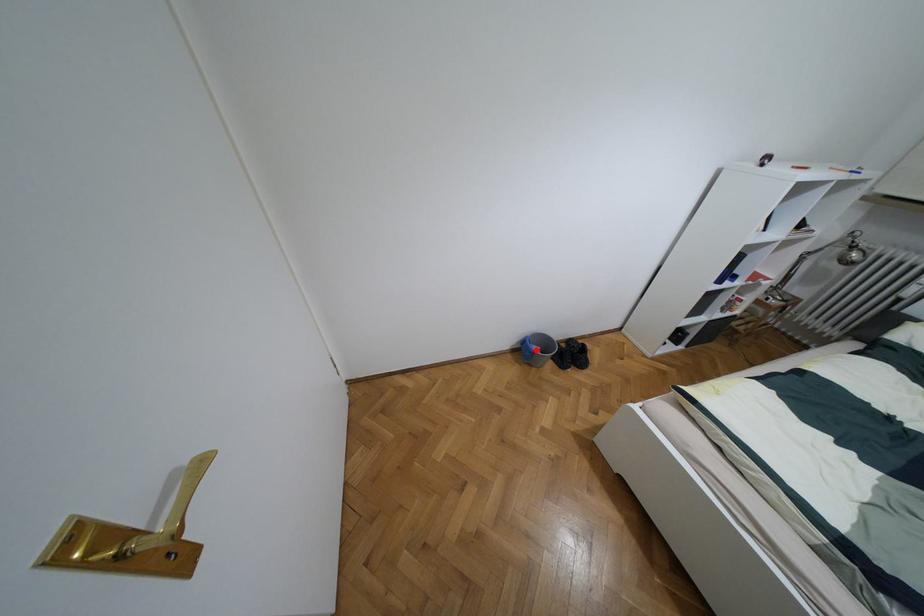
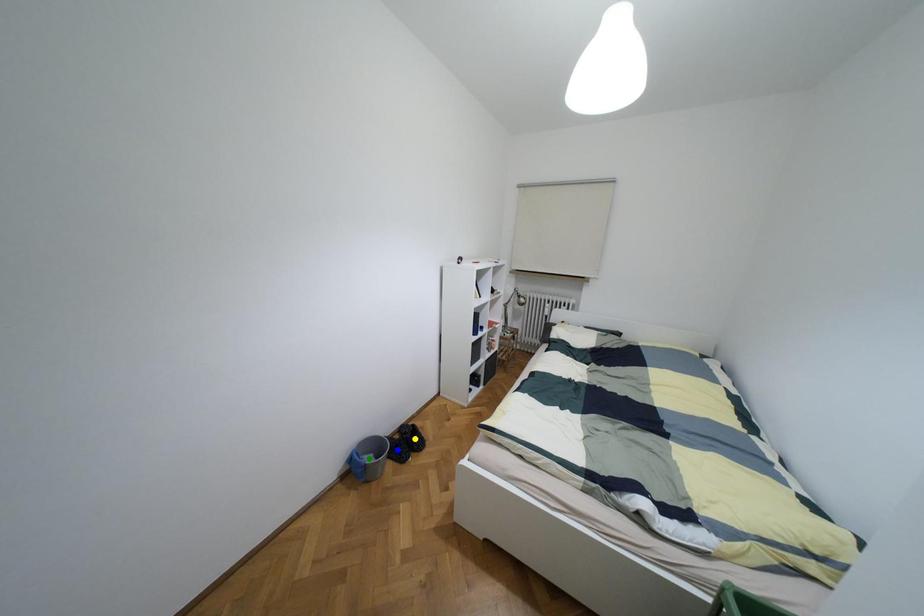
Question: I am providing you with two images of the same scene from different viewpoints. A red point is marked on the first image. You are given multiple points on the second image. In image 2, which mark is for the same physical point as the one in image 1?

Choices:
 (A) blue point
 (B) green point
 (C) yellow point

Answer: (B)